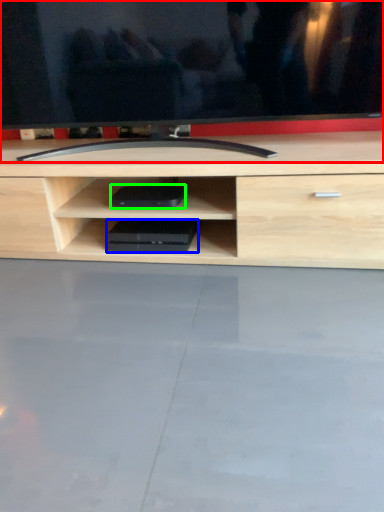
Question: Which is farther away from television (highlighted by a red box)? equipment (highlighted by a blue box) or equipment (highlighted by a green box)?

Choices:
 (A) equipment
 (B) equipment

Answer: (A)